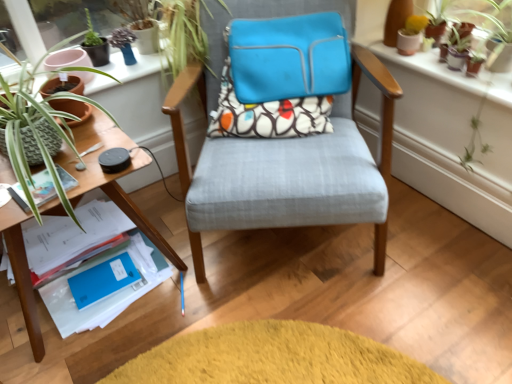
Where is `free space above terracotta clay pots at upper right (from a real-world perspective)`? The height and width of the screenshot is (384, 512). free space above terracotta clay pots at upper right (from a real-world perspective) is located at coordinates (454, 51).